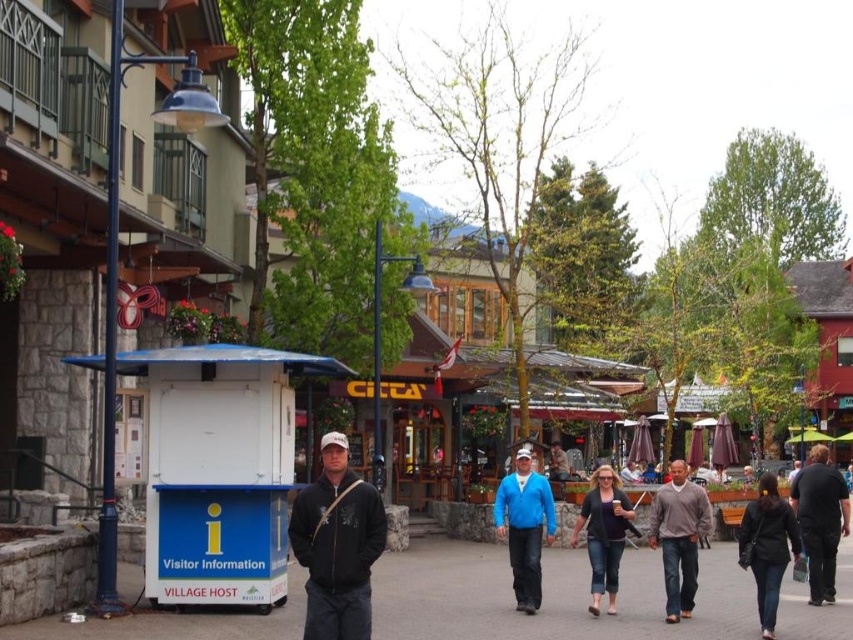
Question: Is dark gray asphalt at center above denim pants at center?

Choices:
 (A) yes
 (B) no

Answer: (B)

Question: Which object is positioned closest to the brown sweater at center?

Choices:
 (A) black matte jacket at lower right
 (B) dark gray hoodie at center

Answer: (A)

Question: Which point is farther to the camera?

Choices:
 (A) (482, 598)
 (B) (833, 544)

Answer: (B)

Question: Which point is closer to the camera?

Choices:
 (A) dark brown leather jacket at lower right
 (B) brown sweater at center

Answer: (A)

Question: Is brown sweater at center further to camera compared to black matte jacket at lower right?

Choices:
 (A) yes
 (B) no

Answer: (B)

Question: Does dark gray hoodie at center have a smaller size compared to brown sweater at center?

Choices:
 (A) yes
 (B) no

Answer: (A)